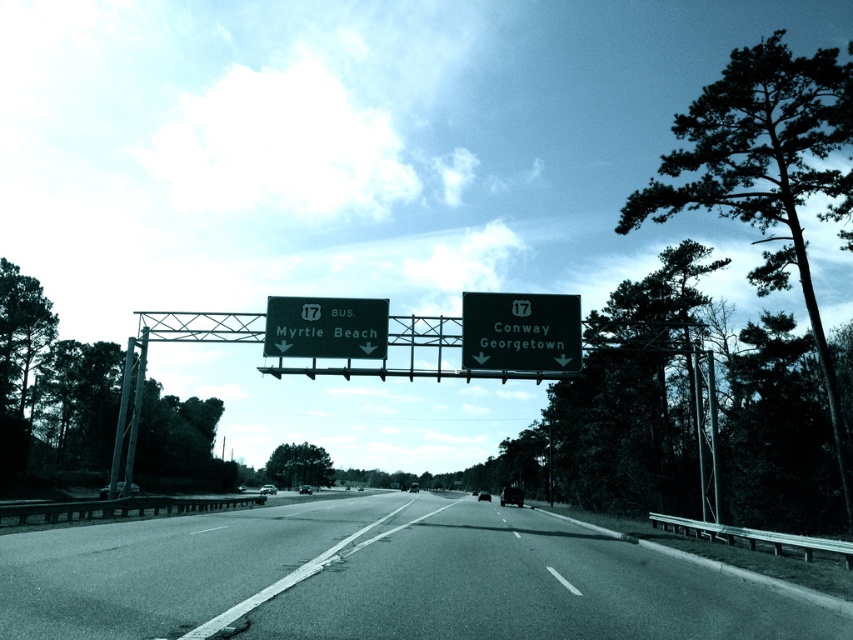
Does asphalt road at center appear over green matte sign at upper center?

Incorrect, asphalt road at center is not positioned above green matte sign at upper center.

Between point (399, 492) and point (349, 305), which one is positioned behind?

Positioned behind is point (399, 492).

You are a GUI agent. You are given a task and a screenshot of the screen. Output one action in this format:
    pyautogui.click(x=<x>, y=<y>)
    Task: Click on the asphalt road at center
    This screenshot has height=640, width=853.
    Given the screenshot: What is the action you would take?
    pyautogui.click(x=376, y=579)

Who is positioned more to the left, green metallic sign at upper center or green matte sign at upper center?

Positioned to the left is green matte sign at upper center.

Measure the distance between point (463,344) and camera.

Point (463,344) and camera are 30.16 meters apart from each other.

The width and height of the screenshot is (853, 640). Identify the location of green metallic sign at upper center. pyautogui.click(x=520, y=332).

Who is shorter, asphalt road at center or green metallic sign at upper center?

Standing shorter between the two is green metallic sign at upper center.

Between asphalt road at center and green metallic sign at upper center, which one appears on the right side from the viewer's perspective?

From the viewer's perspective, green metallic sign at upper center appears more on the right side.

Describe the element at coordinates (376, 579) in the screenshot. I see `asphalt road at center` at that location.

I want to click on asphalt road at center, so click(376, 579).